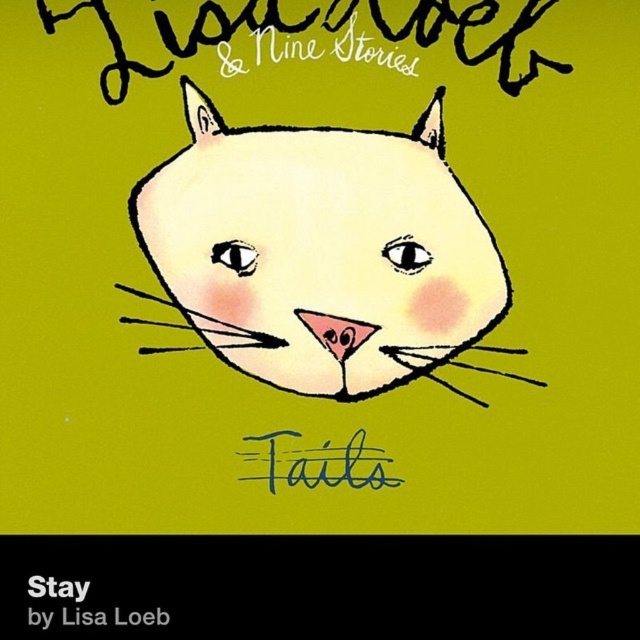
In the scene shown: You are designing a poster and need to place two elements on it. You have the handwritten ink text at upper center and the blue handwritten text at center. According to the image, which text is positioned higher?

The handwritten ink text at upper center is positioned higher than the blue handwritten text at center.

You are an artist who wants to paint a new layer on top of the image. If you decide to paint over the matte white cat at center and the blue handwritten text at center, which object should you paint first to ensure the other remains visible underneath?

You should paint the blue handwritten text at center first because the matte white cat at center is closer to the viewer. Painting the blue handwritten text at center first allows the matte white cat at center to be painted over it and remain visible on top.